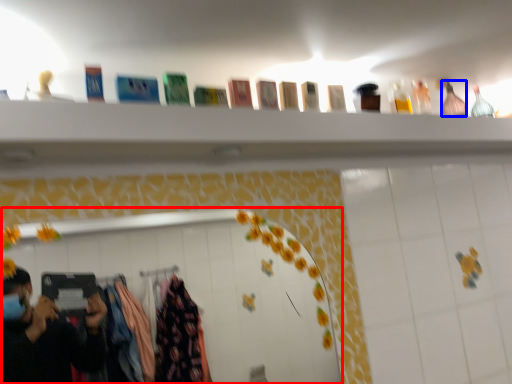
Question: Which of the following is the closest to the observer, mirror (highlighted by a red box) or bottle (highlighted by a blue box)?

Choices:
 (A) mirror
 (B) bottle

Answer: (A)